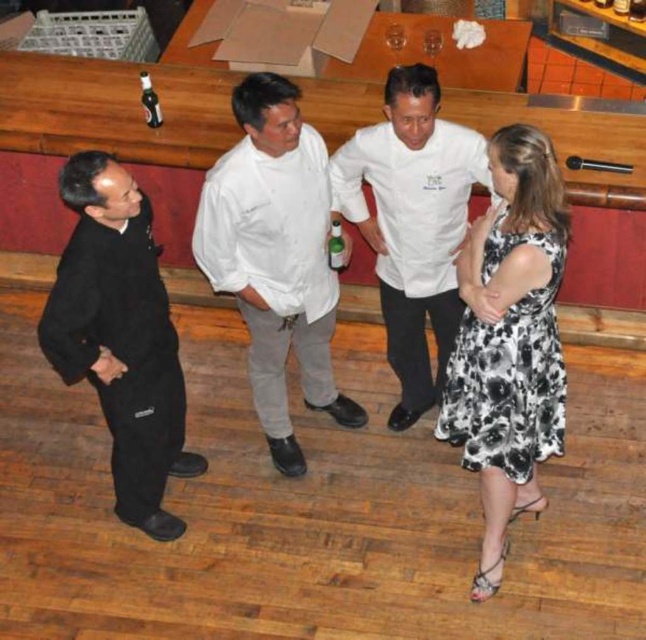
You are a customer who just entered the restaurant and see the white cotton chef coat at center and the clear glass bottle at upper left. Which object is wider?

The white cotton chef coat at center is wider than the clear glass bottle at upper left.

You are standing at the origin point in the image and need to reach a specific location. Which point should you head towards first if you want to reach point (149, 120)? Is it point (280, 106) or another point?

Point (280, 106) is in front of point (149, 120), so you should head towards point (280, 106) first to reach your destination.